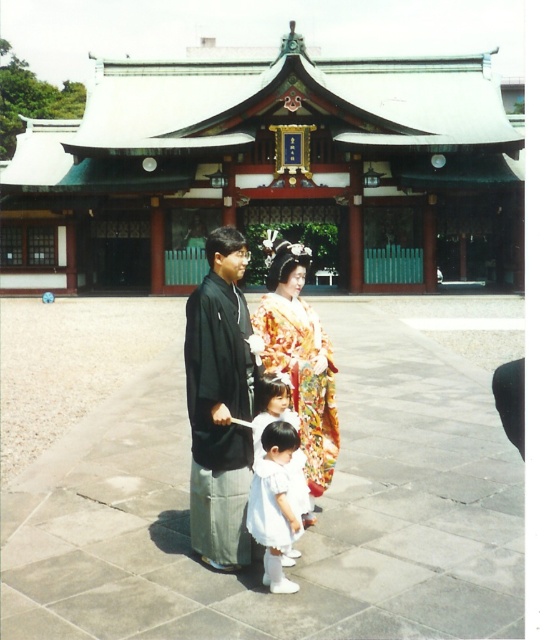
Question: Observing the image, what is the correct spatial positioning of black matte kimono at center in reference to white satin dress at lower center?

Choices:
 (A) below
 (B) above

Answer: (B)

Question: Does silk kimono at center appear over white satin dress at lower center?

Choices:
 (A) no
 (B) yes

Answer: (B)

Question: Which is nearer to the black matte kimono at center?

Choices:
 (A) silk kimono at center
 (B) white satin dress at lower center

Answer: (B)

Question: Estimate the real-world distances between objects in this image. Which object is closer to the white satin dress at lower center?

Choices:
 (A) silk kimono at center
 (B) black matte kimono at center

Answer: (B)

Question: Observing the image, what is the correct spatial positioning of black matte kimono at center in reference to silk kimono at center?

Choices:
 (A) above
 (B) below

Answer: (B)

Question: Among these objects, which one is farthest from the camera?

Choices:
 (A) black matte kimono at center
 (B) white satin dress at lower center

Answer: (A)